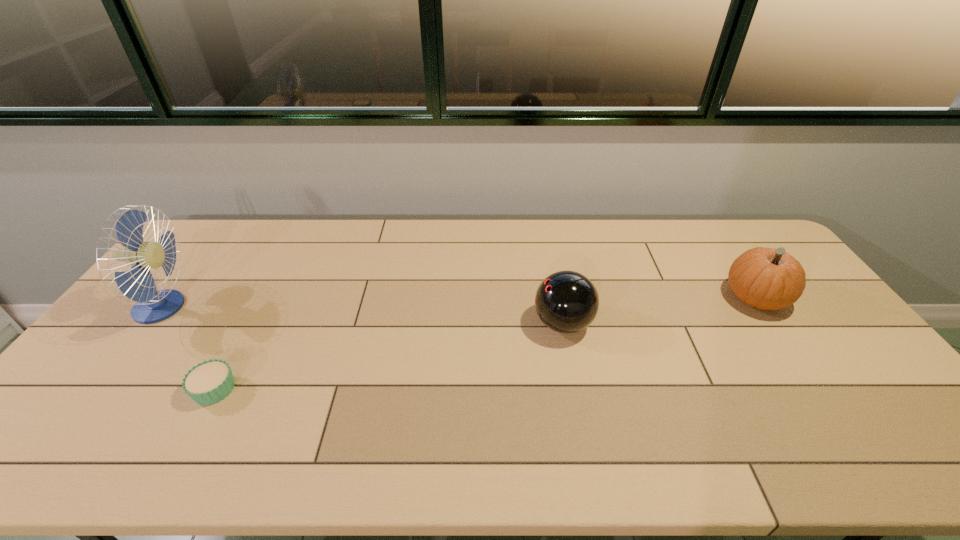
At what (x,y) coordinates should I click in order to perform the action: click on free spot between the bowling ball and the nearest object. Please return your answer as a coordinate pair (x, y). This screenshot has height=540, width=960. Looking at the image, I should click on (389, 356).

You are a GUI agent. You are given a task and a screenshot of the screen. Output one action in this format:
    pyautogui.click(x=<x>, y=<y>)
    Task: Click on the free space between the tallest object and the second object from right to left
    This screenshot has height=540, width=960.
    Given the screenshot: What is the action you would take?
    pyautogui.click(x=363, y=315)

Find the location of a particular element. This screenshot has height=540, width=960. vacant area that lies between the pumpkin and the fan is located at coordinates (459, 303).

Identify the location of the second closest object to the fan. The height and width of the screenshot is (540, 960). (566, 301).

Locate an element on the screen. object that is the third closest to the second tallest object is located at coordinates (151, 306).

This screenshot has height=540, width=960. I want to click on vacant space that satisfies the following two spatial constraints: 1. at the front of the fan where the blades are visible; 2. on the left side of the shortest object, so click(x=100, y=389).

This screenshot has width=960, height=540. Find the location of `vacant point that satisfies the following two spatial constraints: 1. at the front of the fan where the blades are visible; 2. on the back side of the nearest object`. vacant point that satisfies the following two spatial constraints: 1. at the front of the fan where the blades are visible; 2. on the back side of the nearest object is located at coordinates (100, 389).

Where is `vacant space that satisfies the following two spatial constraints: 1. at the front of the cupcake where the blades are visible; 2. on the right side of the tallest object`? The height and width of the screenshot is (540, 960). vacant space that satisfies the following two spatial constraints: 1. at the front of the cupcake where the blades are visible; 2. on the right side of the tallest object is located at coordinates (100, 389).